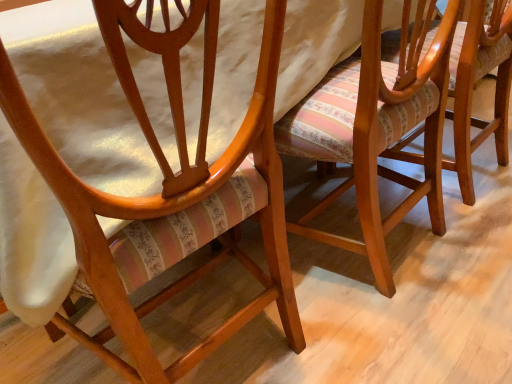
Question: Can you confirm if matte wood chair at center, marked as the 1th chair in a left-to-right arrangement, is taller than wooden chair with striped upholstery at center, which is counted as the second chair, starting from the right?

Choices:
 (A) yes
 (B) no

Answer: (A)

Question: Are matte wood chair at center, the 3th chair positioned from the right, and wooden chair with striped upholstery at center, which is counted as the second chair, starting from the right, far apart?

Choices:
 (A) yes
 (B) no

Answer: (B)

Question: Considering the relative sizes of matte wood chair at center, marked as the 1th chair in a left-to-right arrangement, and wooden chair with striped upholstery at center, which ranks as the 2th chair in left-to-right order, in the image provided, is matte wood chair at center, marked as the 1th chair in a left-to-right arrangement, smaller than wooden chair with striped upholstery at center, which ranks as the 2th chair in left-to-right order,?

Choices:
 (A) yes
 (B) no

Answer: (B)

Question: From the image's perspective, is matte wood chair at center, the 3th chair positioned from the right, under wooden chair with striped upholstery at center, which ranks as the 2th chair in left-to-right order?

Choices:
 (A) yes
 (B) no

Answer: (A)

Question: Can you confirm if matte wood chair at center, marked as the 1th chair in a left-to-right arrangement, is shorter than wooden chair with striped upholstery at center, which is counted as the second chair, starting from the right?

Choices:
 (A) no
 (B) yes

Answer: (A)

Question: Would you say wooden chair with striped upholstery at center, which is counted as the second chair, starting from the right, is part of matte wood chair at center, marked as the 1th chair in a left-to-right arrangement,'s contents?

Choices:
 (A) no
 (B) yes

Answer: (A)

Question: Is the depth of wooden chair with striped upholstery at center, which ranks as the 2th chair in left-to-right order, greater than that of matte wood chair at center, marked as the 1th chair in a left-to-right arrangement?

Choices:
 (A) no
 (B) yes

Answer: (B)

Question: Is wooden chair with striped upholstery at center, which ranks as the 2th chair in left-to-right order, aimed at matte wood chair at center, marked as the 1th chair in a left-to-right arrangement?

Choices:
 (A) yes
 (B) no

Answer: (B)

Question: Can you confirm if wooden chair with striped upholstery at center, which ranks as the 2th chair in left-to-right order, is bigger than matte wood chair at center, marked as the 1th chair in a left-to-right arrangement?

Choices:
 (A) no
 (B) yes

Answer: (A)

Question: Would you say wooden chair with striped upholstery at center, which is counted as the second chair, starting from the right, is a long distance from matte wood chair at center, marked as the 1th chair in a left-to-right arrangement?

Choices:
 (A) no
 (B) yes

Answer: (A)

Question: Is wooden chair with striped upholstery at center, which is counted as the second chair, starting from the right, taller than matte wood chair at center, marked as the 1th chair in a left-to-right arrangement?

Choices:
 (A) yes
 (B) no

Answer: (B)

Question: Does wooden chair with striped upholstery at center, which ranks as the 2th chair in left-to-right order, appear on the right side of matte wood chair at center, marked as the 1th chair in a left-to-right arrangement?

Choices:
 (A) no
 (B) yes

Answer: (B)

Question: Is wooden chair with striped upholstery at center, which is counted as the second chair, starting from the right, shorter than striped fabric cushion at center, acting as the 3th chair starting from the left?

Choices:
 (A) no
 (B) yes

Answer: (A)